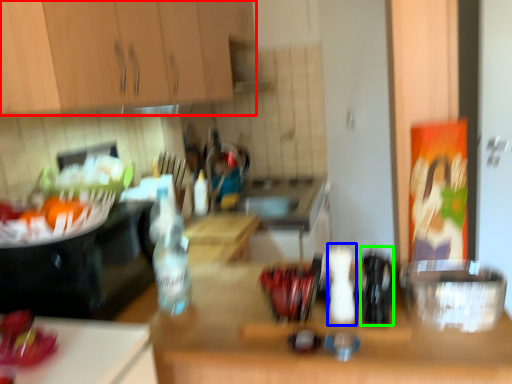
Question: Which is farther away from cabinetry (highlighted by a red box)? bottle (highlighted by a blue box) or bottle (highlighted by a green box)?

Choices:
 (A) bottle
 (B) bottle

Answer: (B)